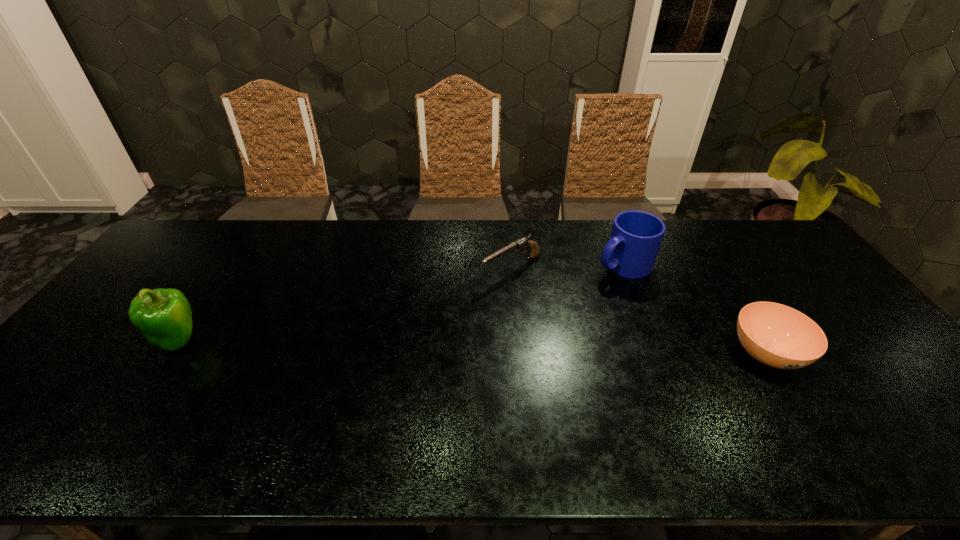
Identify the location of free space between the rightmost object and the second object from right to left. (694, 309).

Where is `object that is the third closest to the bell pepper`? This screenshot has height=540, width=960. object that is the third closest to the bell pepper is located at coordinates (778, 336).

Point out which object is positioned as the third nearest to the second object from left to right. Please provide its 2D coordinates. Your answer should be formatted as a tuple, i.e. [(x, y)], where the tuple contains the x and y coordinates of a point satisfying the conditions above.

[(164, 316)]

Find the location of a particular element. This screenshot has height=540, width=960. free space that satisfies the following two spatial constraints: 1. on the back side of the third object from right to left; 2. on the left side of the tallest object is located at coordinates pyautogui.click(x=226, y=269).

Find the location of a particular element. blank space that satisfies the following two spatial constraints: 1. on the back side of the gun; 2. on the right side of the second object from right to left is located at coordinates (511, 265).

Locate an element on the screen. This screenshot has height=540, width=960. vacant space that satisfies the following two spatial constraints: 1. on the front side of the bell pepper; 2. on the right side of the soup bowl is located at coordinates (169, 354).

You are a GUI agent. You are given a task and a screenshot of the screen. Output one action in this format:
    pyautogui.click(x=<x>, y=<y>)
    Task: Click on the free region that satisfies the following two spatial constraints: 1. on the front side of the rightmost object; 2. on the left side of the gun
    This screenshot has height=540, width=960.
    Given the screenshot: What is the action you would take?
    pyautogui.click(x=518, y=354)

The image size is (960, 540). Find the location of `free space that satisfies the following two spatial constraints: 1. on the back side of the gun; 2. on the left side of the second tallest object`. free space that satisfies the following two spatial constraints: 1. on the back side of the gun; 2. on the left side of the second tallest object is located at coordinates (511, 265).